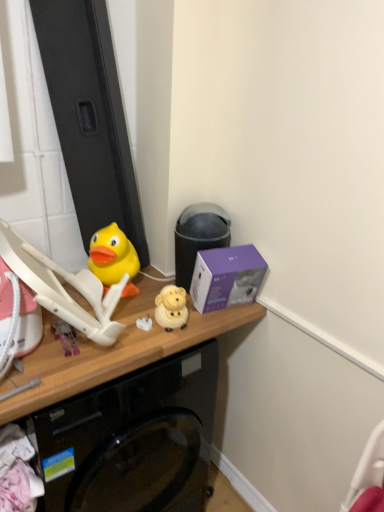
Locate an element on the screen. vacant space situated on the left part of yellow matte sheep at center, which is the 1th toy in right-to-left order is located at coordinates point(130,325).